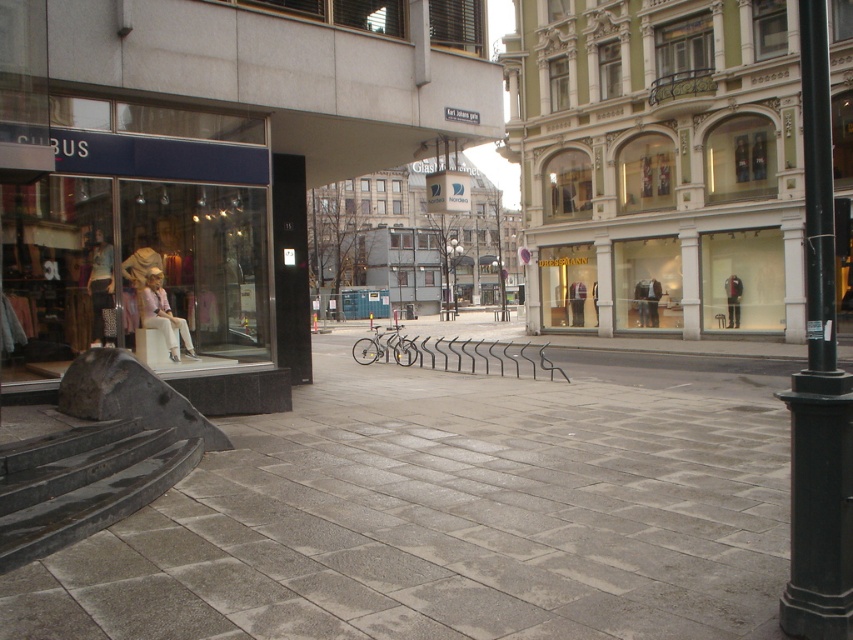
You are a tourist standing on the pedestrian area and want to take a photo of both the black metal lamp post at center and the black metal pole at center. Which one should you position to your left side to include both in the frame?

You should position the black metal lamp post at center to your left side because it is located to the left of the black metal pole at center, so arranging them with the lamp post on your left will capture both in the photo.

You are a city planner analyzing the urban street scene. You need to determine which object, the gray concrete pavement at center or the black metal lamp post at center, is taller. Based on the scene description, which one is taller?

The black metal lamp post at center is taller than the gray concrete pavement at center.